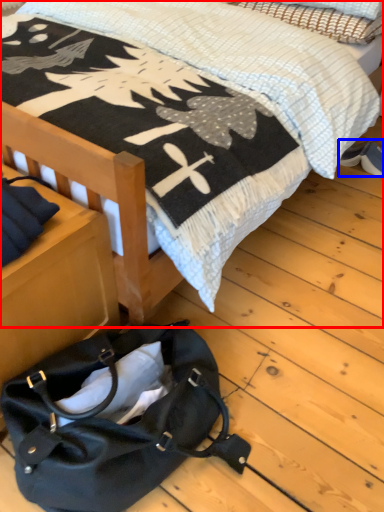
Question: Among these objects, which one is nearest to the camera, bed (highlighted by a red box) or footwear (highlighted by a blue box)?

Choices:
 (A) bed
 (B) footwear

Answer: (A)